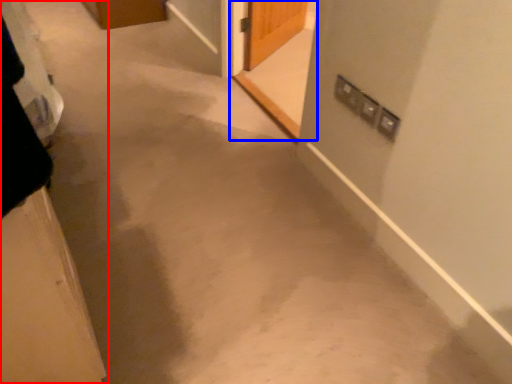
Question: Which point is further to the camera, door (highlighted by a red box) or screen door (highlighted by a blue box)?

Choices:
 (A) door
 (B) screen door

Answer: (B)